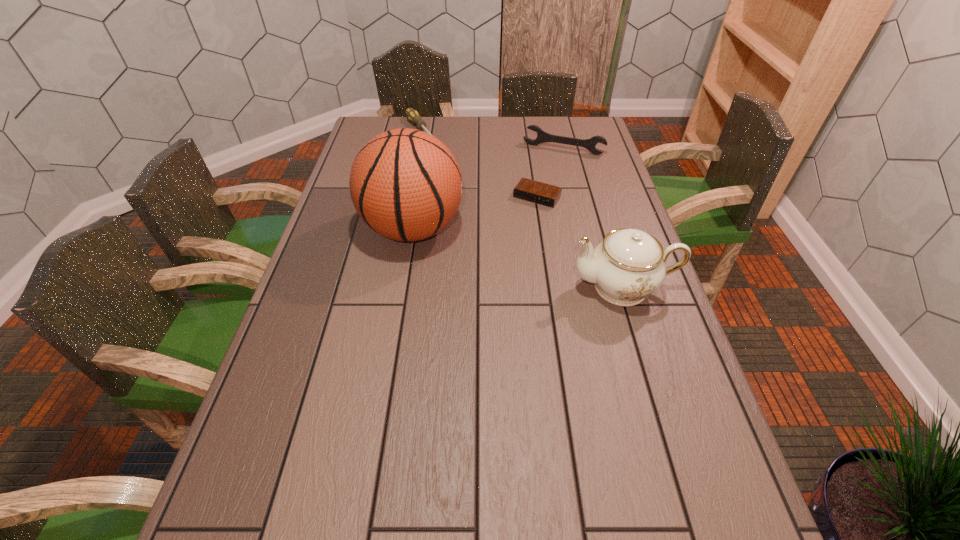
You are a GUI agent. You are given a task and a screenshot of the screen. Output one action in this format:
    pyautogui.click(x=<x>, y=<y>)
    Task: Click on the object situated at the left edge
    
    Given the screenshot: What is the action you would take?
    pyautogui.click(x=405, y=184)

Locate an element on the screen. chinaware at the right edge is located at coordinates (628, 265).

I want to click on wrench at the right edge, so tap(542, 136).

The image size is (960, 540). What are the coordinates of `object at the far right corner` in the screenshot? It's located at [x=542, y=136].

The width and height of the screenshot is (960, 540). What are the coordinates of `vacant space at the far edge of the desktop` in the screenshot? It's located at (504, 120).

In the image, there is a desktop. Identify the location of vacant space at the left edge. (349, 170).

At what (x,y) coordinates should I click in order to perform the action: click on vacant space at the right edge of the desktop. Please return your answer as a coordinate pair (x, y). The height and width of the screenshot is (540, 960). Looking at the image, I should click on (612, 325).

In the image, there is a desktop. Where is `vacant space at the far right corner`? The image size is (960, 540). vacant space at the far right corner is located at coordinates (585, 132).

In the image, there is a desktop. What are the coordinates of `vacant space at the near right corner` in the screenshot? It's located at (648, 478).

Find the location of `free spot between the shortest object and the fourth shortest object`. free spot between the shortest object and the fourth shortest object is located at coordinates (580, 242).